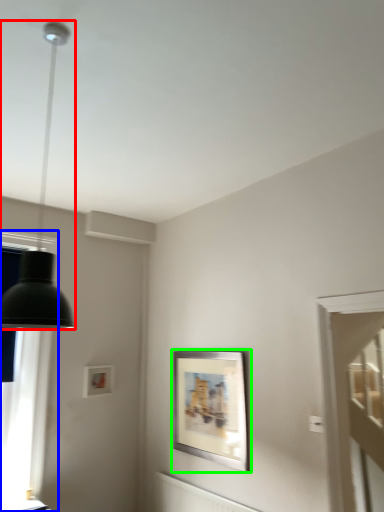
Question: Which object is the farthest from lamp (highlighted by a red box)? Choose among these: window (highlighted by a blue box) or picture frame (highlighted by a green box).

Choices:
 (A) window
 (B) picture frame

Answer: (B)